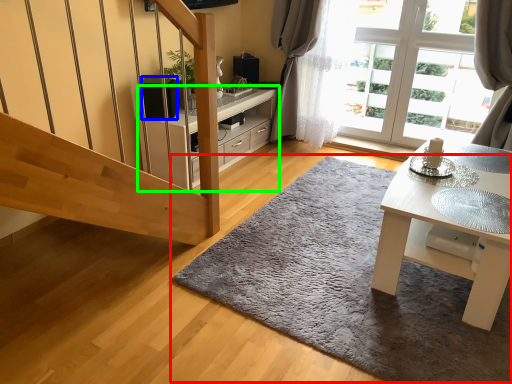
Question: Which object is positioned farthest from doormat (highlighted by a red box)? Select from speaker (highlighted by a blue box) and cabinetry (highlighted by a green box).

Choices:
 (A) speaker
 (B) cabinetry

Answer: (A)